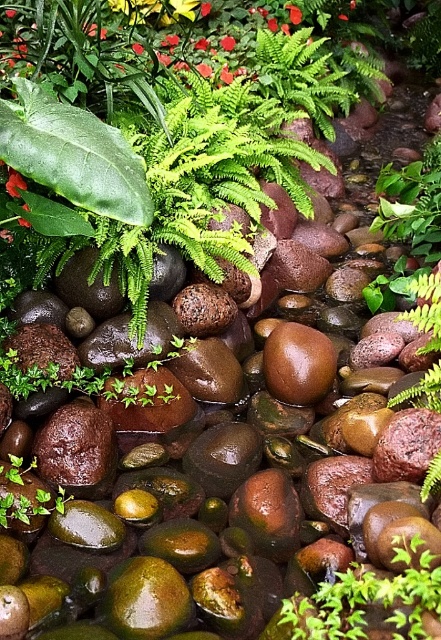
Based on the photo, who is shorter, smooth glossy petal at center or red matte flower at upper center?

With less height is smooth glossy petal at center.

Identify the location of smooth glossy petal at center. This screenshot has height=640, width=441. (294, 13).

Who is more distant from viewer, (296, 12) or (230, 49)?

Point (296, 12)

In order to click on smooth glossy petal at center in this screenshot , I will do `click(294, 13)`.

Does shiny brown rock at center appear on the right side of red matte flower at upper center?

Correct, you'll find shiny brown rock at center to the right of red matte flower at upper center.

This screenshot has height=640, width=441. In order to click on shiny brown rock at center in this screenshot , I will do `click(298, 364)`.

At what (x,y) coordinates should I click in order to perform the action: click on shiny brown rock at center. Please return your answer as a coordinate pair (x, y). Looking at the image, I should click on (298, 364).

What are the coordinates of `shiny brown rock at center` in the screenshot? It's located at (298, 364).

What do you see at coordinates (298, 364) in the screenshot? I see `shiny brown rock at center` at bounding box center [298, 364].

Which is above, shiny brown rock at center or smooth glossy petal at center?

smooth glossy petal at center is above.

Is point (284, 392) positioned before point (295, 8)?

Yes, point (284, 392) is in front of point (295, 8).

The width and height of the screenshot is (441, 640). Identify the location of shiny brown rock at center. (298, 364).